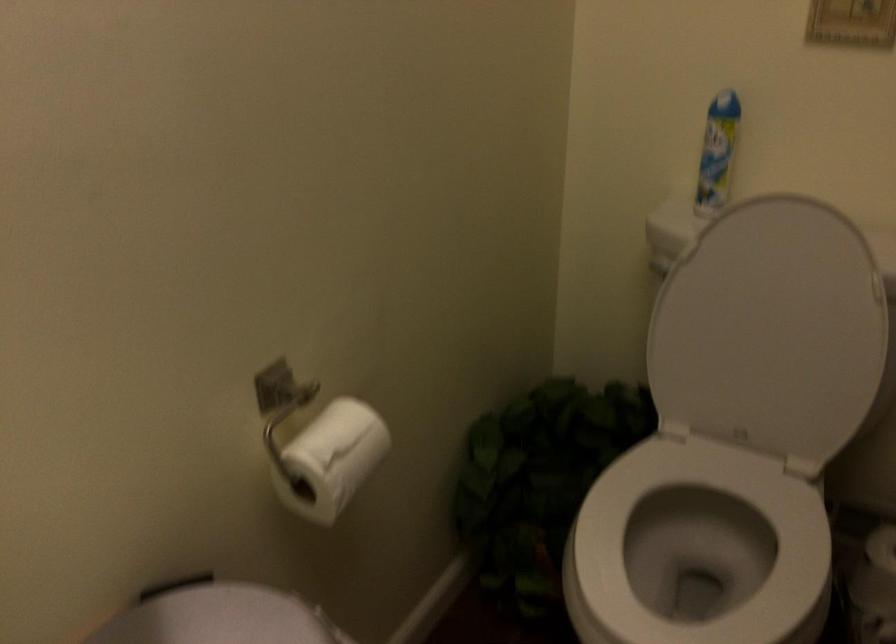
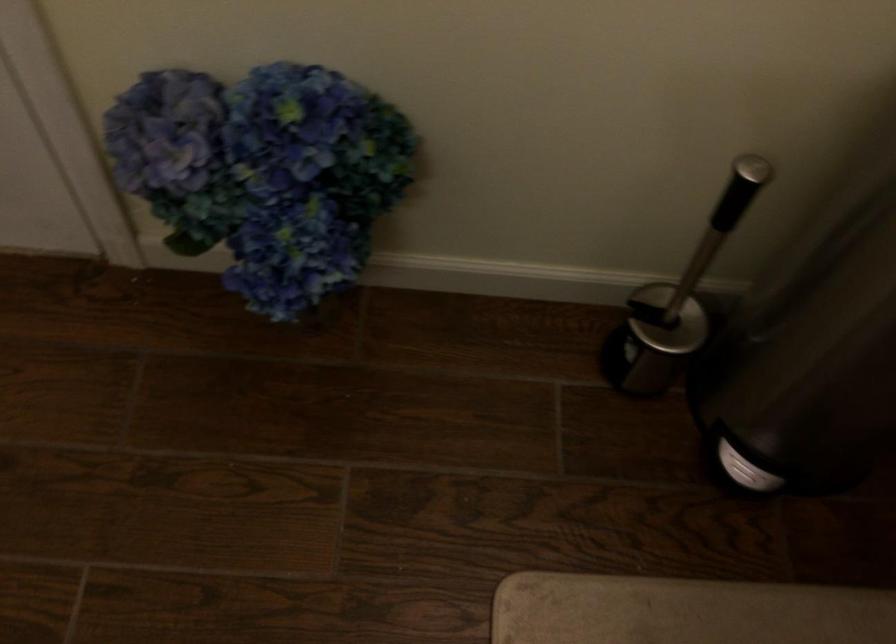
First-person continuous shooting, in which direction is the camera rotating?

The camera's rotation is toward left-down.